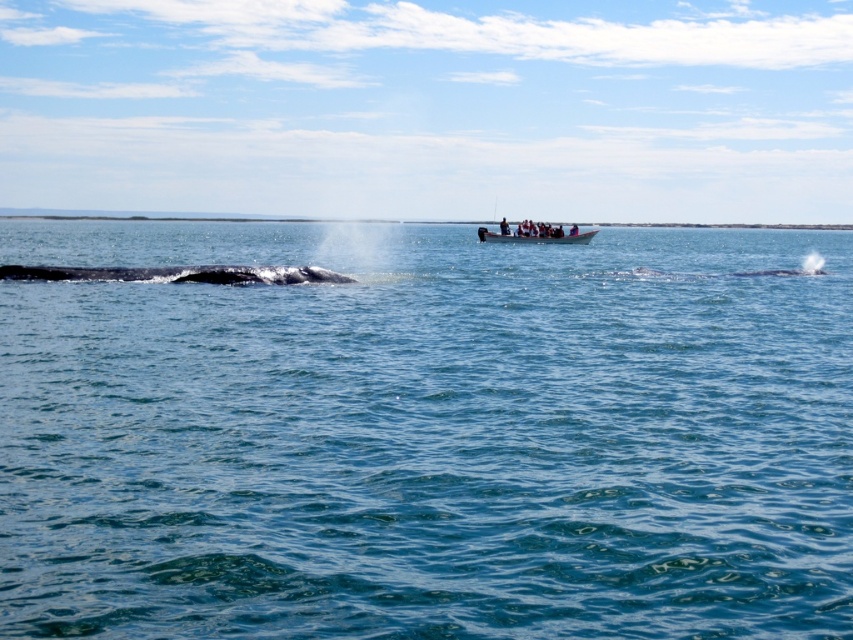
Who is taller, clear blue water at center or wooden boat at center?

With more height is clear blue water at center.

Identify the location of clear blue water at center. The height and width of the screenshot is (640, 853). (426, 435).

Where is `clear blue water at center`? This screenshot has height=640, width=853. clear blue water at center is located at coordinates (426, 435).

Find the location of a particular element. This screenshot has height=640, width=853. gray matte whale at left is located at coordinates (180, 273).

Does gray matte whale at left have a lesser height compared to wooden boat at center?

Yes, gray matte whale at left is shorter than wooden boat at center.

The image size is (853, 640). What do you see at coordinates (180, 273) in the screenshot?
I see `gray matte whale at left` at bounding box center [180, 273].

At what (x,y) coordinates should I click in order to perform the action: click on gray matte whale at left. Please return your answer as a coordinate pair (x, y). Looking at the image, I should click on (180, 273).

Who is more forward, [90,372] or [253,280]?

Point [90,372]

Is point (30, 353) farther from camera compared to point (241, 276)?

No, (30, 353) is in front of (241, 276).

Does point (415, 518) come behind point (184, 268)?

No, (415, 518) is in front of (184, 268).

You are a GUI agent. You are given a task and a screenshot of the screen. Output one action in this format:
    pyautogui.click(x=<x>, y=<y>)
    Task: Click on the clear blue water at center
    This screenshot has width=853, height=640.
    Given the screenshot: What is the action you would take?
    pyautogui.click(x=426, y=435)